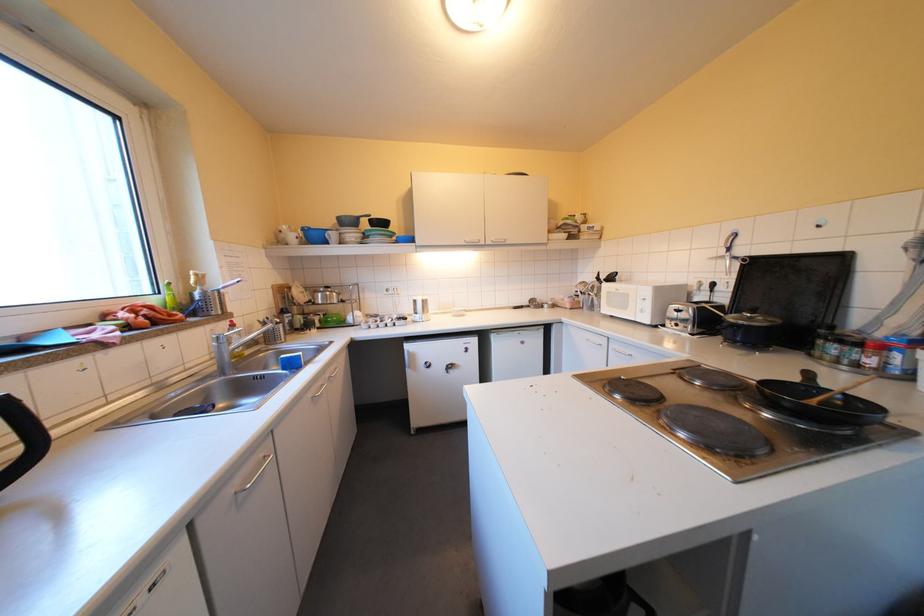
The image size is (924, 616). Describe the element at coordinates (450, 367) in the screenshot. I see `a refrigerator lock key` at that location.